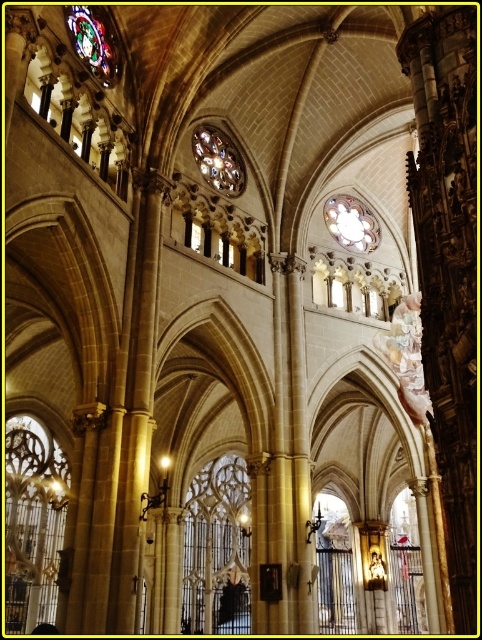
You are standing in the cathedral and want to locate the clear glass window at center. According to the coordinates provided, where should you look? Please provide the coordinates in the format of a point like point (216, 548).

The clear glass window at center is located at point (216, 548).

You are standing in the cathedral and want to locate the stained glass window at upper left and the matte glass clock at center. From your perspective, which object is positioned to the left of the other?

The stained glass window at upper left is to the left of the matte glass clock at center.